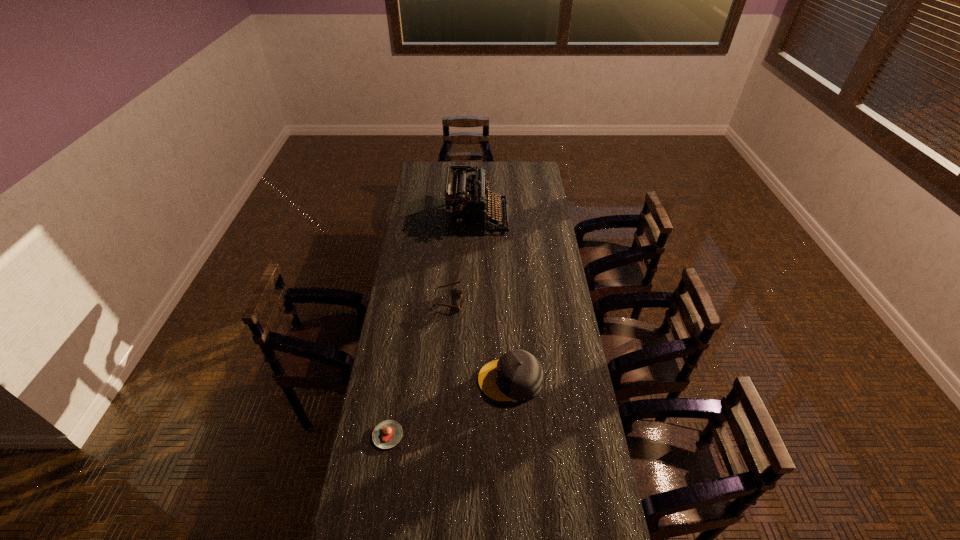
Find the location of `vacant space that is in between the third tallest object and the cap`. vacant space that is in between the third tallest object and the cap is located at coordinates (479, 340).

Find the location of a particular element. free spot between the leftmost object and the tallest object is located at coordinates (433, 327).

Identify the location of free space between the cap and the nearest object. The width and height of the screenshot is (960, 540). (449, 408).

Locate an element on the screen. The height and width of the screenshot is (540, 960). vacant area that lies between the tallest object and the second nearest object is located at coordinates (493, 299).

The width and height of the screenshot is (960, 540). What are the coordinates of `vacant point located between the typewriter and the third shortest object` in the screenshot? It's located at (493, 299).

Where is `vacant area between the sunglasses and the second nearest object`? The height and width of the screenshot is (540, 960). vacant area between the sunglasses and the second nearest object is located at coordinates (479, 340).

Locate an element on the screen. vacant area between the farthest object and the leftmost object is located at coordinates (433, 327).

Where is `empty location between the third shortest object and the second farthest object`? The image size is (960, 540). empty location between the third shortest object and the second farthest object is located at coordinates (479, 340).

The height and width of the screenshot is (540, 960). Find the location of `vacant space in between the cap and the tallest object`. vacant space in between the cap and the tallest object is located at coordinates (493, 299).

Locate an element on the screen. the second closest object to the third farthest object is located at coordinates (387, 434).